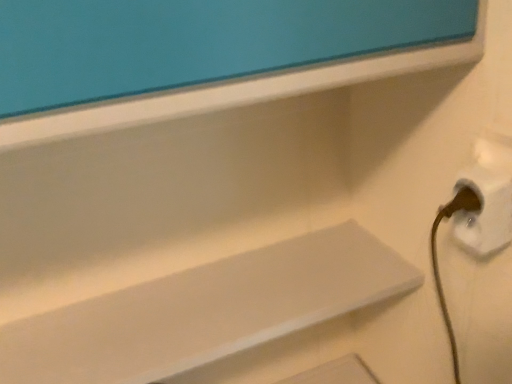
Question: Is white plastic electric outlet at lower right bigger than white matte shelf at center?

Choices:
 (A) yes
 (B) no

Answer: (B)

Question: Is white plastic electric outlet at lower right turned away from white matte shelf at center?

Choices:
 (A) no
 (B) yes

Answer: (A)

Question: Is white plastic electric outlet at lower right shorter than white matte shelf at center?

Choices:
 (A) yes
 (B) no

Answer: (B)

Question: Is the surface of white plastic electric outlet at lower right in direct contact with white matte shelf at center?

Choices:
 (A) yes
 (B) no

Answer: (B)

Question: Can you confirm if white plastic electric outlet at lower right is positioned to the left of white matte shelf at center?

Choices:
 (A) no
 (B) yes

Answer: (A)

Question: From the image's perspective, would you say white plastic electric outlet at lower right is positioned over white matte shelf at center?

Choices:
 (A) no
 (B) yes

Answer: (B)

Question: From the image's perspective, would you say white matte shelf at center is positioned over white plastic electric outlet at lower right?

Choices:
 (A) no
 (B) yes

Answer: (A)

Question: From a real-world perspective, is white matte shelf at center over white plastic electric outlet at lower right?

Choices:
 (A) no
 (B) yes

Answer: (A)

Question: Is white matte shelf at center next to white plastic electric outlet at lower right?

Choices:
 (A) no
 (B) yes

Answer: (A)

Question: Is white matte shelf at center at the left side of white plastic electric outlet at lower right?

Choices:
 (A) yes
 (B) no

Answer: (A)

Question: Considering the relative sizes of white matte shelf at center and white plastic electric outlet at lower right in the image provided, is white matte shelf at center thinner than white plastic electric outlet at lower right?

Choices:
 (A) yes
 (B) no

Answer: (B)

Question: Considering the relative positions of white matte shelf at center and white plastic electric outlet at lower right in the image provided, is white matte shelf at center behind white plastic electric outlet at lower right?

Choices:
 (A) yes
 (B) no

Answer: (A)

Question: From a real-world perspective, relative to white plastic electric outlet at lower right, is white matte shelf at center vertically above or below?

Choices:
 (A) below
 (B) above

Answer: (A)